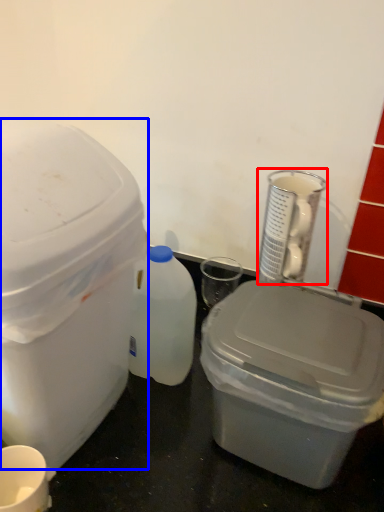
Question: Which point is further to the camera, appliance (highlighted by a red box) or storage box (highlighted by a blue box)?

Choices:
 (A) appliance
 (B) storage box

Answer: (A)